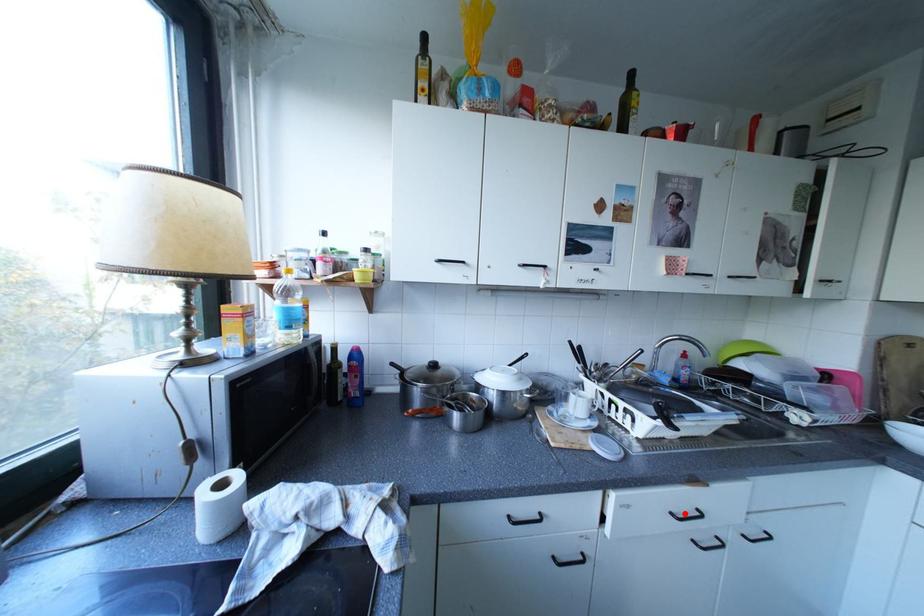
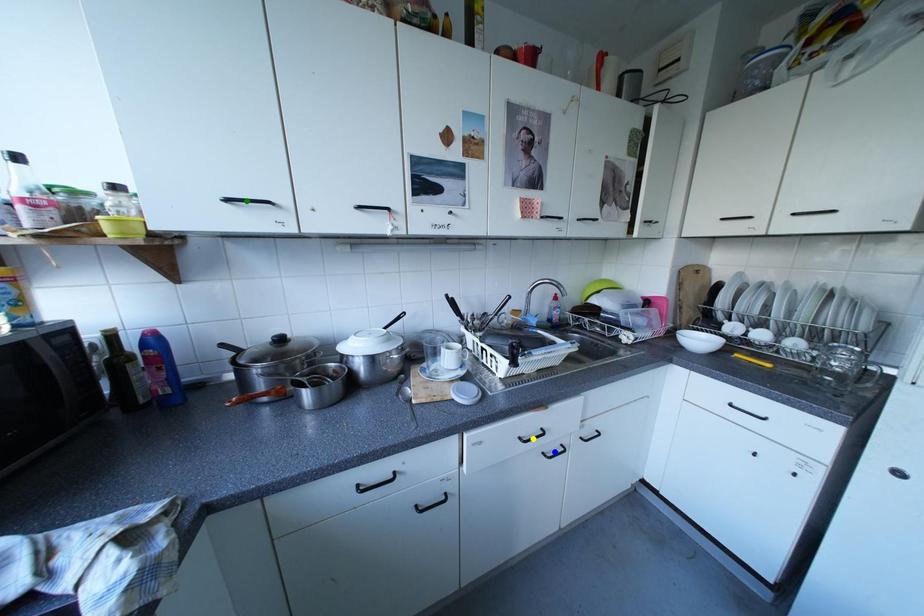
Question: I am providing you with two images of the same scene from different viewpoints. A red point is marked on the first image. You are given multiple points on the second image. Can you choose the point in image 2 that corresponds to the point in image 1?

Choices:
 (A) yellow point
 (B) blue point
 (C) green point

Answer: (A)